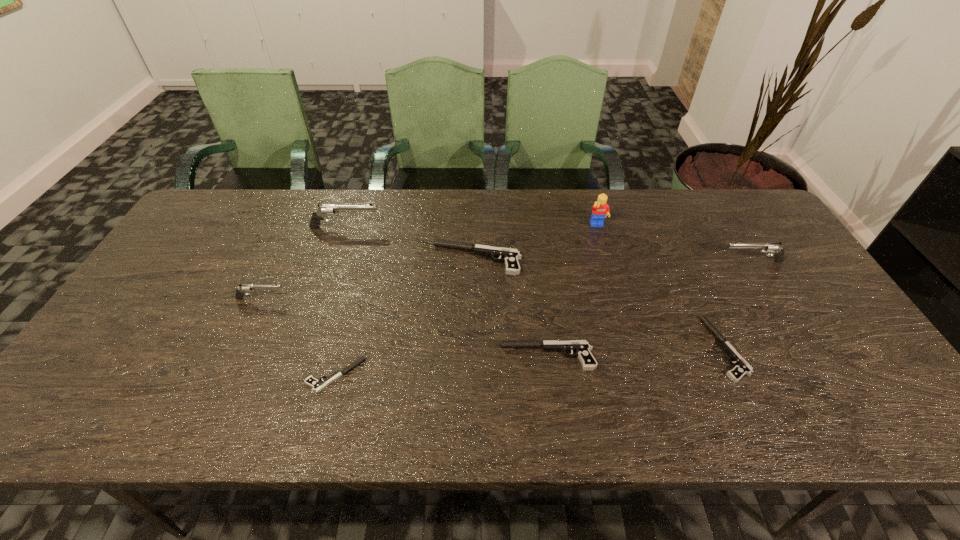
The image size is (960, 540). In order to click on free space between the second smallest silver pistol and the farthest black pistol in this screenshot , I will do `click(614, 260)`.

Select which object is the fourth closest to the fifth tallest object. Please provide its 2D coordinates. Your answer should be formatted as a tuple, i.e. [(x, y)], where the tuple contains the x and y coordinates of a point satisfying the conditions above.

[(317, 386)]

Find the location of a particular element. The width and height of the screenshot is (960, 540). object that is the sixth closest to the smallest silver pistol is located at coordinates (741, 367).

The width and height of the screenshot is (960, 540). Identify the location of the fifth closest pistol to the tallest object. (324, 210).

This screenshot has height=540, width=960. What are the coordinates of `pistol that is the third closest to the biggest black pistol` in the screenshot? It's located at (317, 386).

I want to click on silver pistol that can be found as the second closest to the tallest object, so [x=324, y=210].

This screenshot has width=960, height=540. I want to click on the closest silver pistol to the sixth tallest object, so click(774, 248).

Point out which black pistol is positioned as the second nearest to the sixth tallest object. Please provide its 2D coordinates. Your answer should be formatted as a tuple, i.e. [(x, y)], where the tuple contains the x and y coordinates of a point satisfying the conditions above.

[(741, 367)]

This screenshot has width=960, height=540. In order to click on black pistol that stands as the second closest to the second tallest pistol in this screenshot , I will do `click(581, 347)`.

I want to click on vacant region that satisfies the following two spatial constraints: 1. on the face of the sixth object from left to right; 2. on the front-facing side of the fourth shortest object, so click(x=607, y=259).